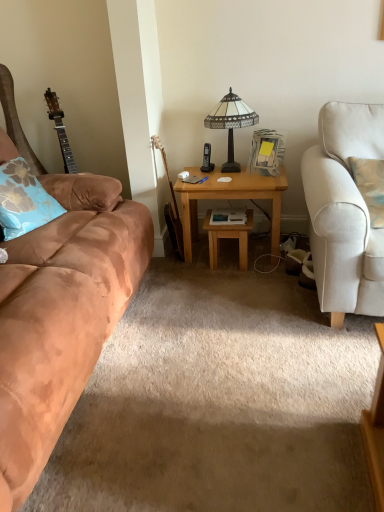
Locate an element on the screen. The width and height of the screenshot is (384, 512). vacant space in front of wooden desk at center is located at coordinates (235, 290).